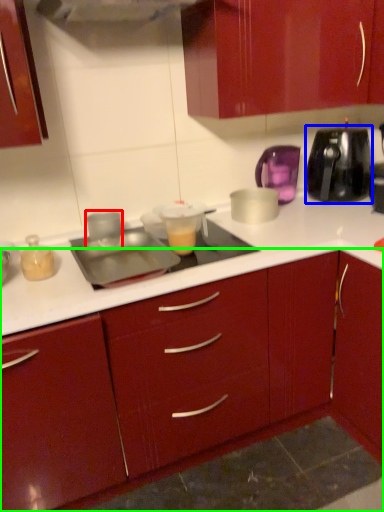
Question: Estimate the real-world distances between objects in this image. Which object is closer to kitchen appliance (highlighted by a red box), kitchen appliance (highlighted by a blue box) or cabinetry (highlighted by a green box)?

Choices:
 (A) kitchen appliance
 (B) cabinetry

Answer: (B)